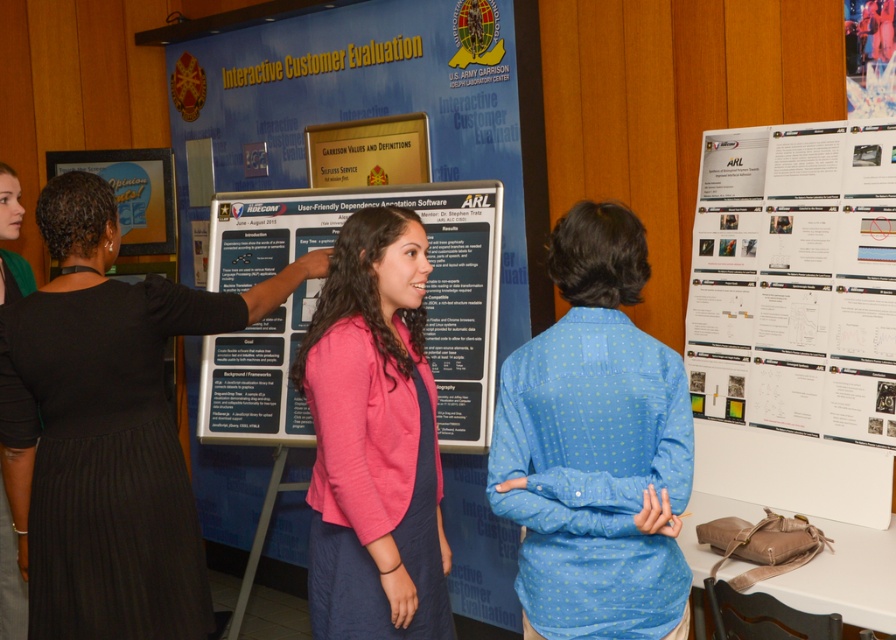
Does blue cardboard poster at center appear under white paper at center?

No.

Who is shorter, blue cardboard poster at center or white paper at center?

Standing shorter between the two is white paper at center.

I want to click on blue cardboard poster at center, so click(x=383, y=200).

Which of these two, black dress at center or blue dotted shirt at center, stands shorter?

With less height is blue dotted shirt at center.

Is black dress at center thinner than blue dotted shirt at center?

In fact, black dress at center might be wider than blue dotted shirt at center.

Image resolution: width=896 pixels, height=640 pixels. Find the location of `black dress at center`. black dress at center is located at coordinates (106, 429).

This screenshot has height=640, width=896. In order to click on black dress at center in this screenshot , I will do `click(106, 429)`.

Can you confirm if blue cardboard poster at center is wider than white paper at right?

Yes, blue cardboard poster at center is wider than white paper at right.

Describe the element at coordinates (383, 200) in the screenshot. I see `blue cardboard poster at center` at that location.

Where is `blue cardboard poster at center`? This screenshot has height=640, width=896. blue cardboard poster at center is located at coordinates (383, 200).